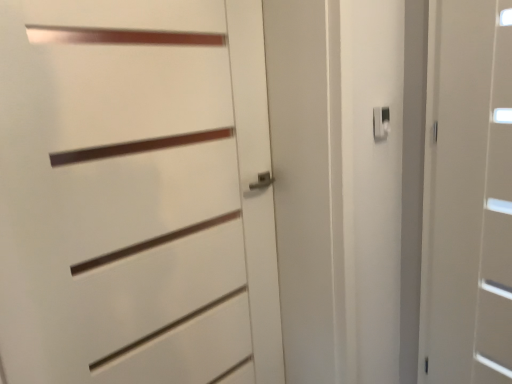
The height and width of the screenshot is (384, 512). What do you see at coordinates (381, 123) in the screenshot?
I see `white plastic latch at upper right` at bounding box center [381, 123].

Locate an element on the screen. The width and height of the screenshot is (512, 384). white matte door at right, placed as the first door when sorted from right to left is located at coordinates (467, 195).

Is white matte door at center, which is counted as the 2th door, starting from the right, not close to white plastic latch at upper right?

white matte door at center, which is counted as the 2th door, starting from the right, is actually quite close to white plastic latch at upper right.

Between white matte door at center, which is counted as the 2th door, starting from the right, and white plastic latch at upper right, which one has less height?

Standing shorter between the two is white plastic latch at upper right.

Does white matte door at center, which is counted as the 2th door, starting from the right, turn towards white plastic latch at upper right?

No.

Is white matte door at right, placed as the first door when sorted from right to left, surrounding white plastic latch at upper right?

No, white plastic latch at upper right is not inside white matte door at right, placed as the first door when sorted from right to left.

Considering the relative sizes of white matte door at right, placed as the first door when sorted from right to left, and white plastic latch at upper right in the image provided, is white matte door at right, placed as the first door when sorted from right to left, thinner than white plastic latch at upper right?

In fact, white matte door at right, placed as the first door when sorted from right to left, might be wider than white plastic latch at upper right.

Is point (450, 106) closer to viewer compared to point (384, 128)?

That is True.

Could you tell me if white matte door at right, which ranks as the 2th door in left-to-right order, is turned towards white plastic latch at upper right?

No, white matte door at right, which ranks as the 2th door in left-to-right order, is not oriented towards white plastic latch at upper right.

Is white plastic latch at upper right in front of or behind white matte door at right, placed as the first door when sorted from right to left, in the image?

white plastic latch at upper right is behind white matte door at right, placed as the first door when sorted from right to left.

Looking at this image, from a real-world perspective, is white plastic latch at upper right positioned under white matte door at right, which ranks as the 2th door in left-to-right order, based on gravity?

No, from a real-world perspective, white plastic latch at upper right is not below white matte door at right, which ranks as the 2th door in left-to-right order.

What's the angular difference between white plastic latch at upper right and white matte door at right, which ranks as the 2th door in left-to-right order,'s facing directions?

The facing directions of white plastic latch at upper right and white matte door at right, which ranks as the 2th door in left-to-right order, are 113 degrees apart.

Can we say white plastic latch at upper right lies outside white matte door at center, which is counted as the 1th door, starting from the left?

Yes, white plastic latch at upper right is located beyond the bounds of white matte door at center, which is counted as the 1th door, starting from the left.

Which object is thinner, white plastic latch at upper right or white matte door at center, which is counted as the 2th door, starting from the right?

white plastic latch at upper right is thinner.

Does white plastic latch at upper right have a smaller size compared to white matte door at center, which is counted as the 1th door, starting from the left?

Yes, white plastic latch at upper right is smaller than white matte door at center, which is counted as the 1th door, starting from the left.

Are white matte door at center, which is counted as the 2th door, starting from the right, and white matte door at right, which ranks as the 2th door in left-to-right order, beside each other?

No.

Locate an element on the screen. This screenshot has width=512, height=384. door below the white matte door at center, which is counted as the 2th door, starting from the right (from a real-world perspective) is located at coordinates (467, 195).

In the scene shown: What's the angular difference between white matte door at center, which is counted as the 1th door, starting from the left, and white matte door at right, which ranks as the 2th door in left-to-right order,'s facing directions?

They differ by 113 degrees in their facing directions.

Which is in front, point (471, 374) or point (92, 6)?

Positioned in front is point (92, 6).

Is white matte door at right, placed as the first door when sorted from right to left, far away from white matte door at center, which is counted as the 1th door, starting from the left?

No, white matte door at right, placed as the first door when sorted from right to left, is not far away from white matte door at center, which is counted as the 1th door, starting from the left.

In terms of width, does white matte door at right, placed as the first door when sorted from right to left, look wider or thinner when compared to white matte door at center, which is counted as the 2th door, starting from the right?

Clearly, white matte door at right, placed as the first door when sorted from right to left, has more width compared to white matte door at center, which is counted as the 2th door, starting from the right.

You are a GUI agent. You are given a task and a screenshot of the screen. Output one action in this format:
    pyautogui.click(x=<x>, y=<y>)
    Task: Click on the latch on the right of white matte door at center, which is counted as the 1th door, starting from the left
    This screenshot has height=384, width=512.
    Given the screenshot: What is the action you would take?
    pyautogui.click(x=381, y=123)

The width and height of the screenshot is (512, 384). What are the coordinates of `latch that appears on the left of white matte door at right, which ranks as the 2th door in left-to-right order` in the screenshot? It's located at (381, 123).

Looking at the image, which one is located closer to white matte door at center, which is counted as the 2th door, starting from the right, white matte door at right, which ranks as the 2th door in left-to-right order, or white plastic latch at upper right?

white plastic latch at upper right.

From the image, which object appears to be nearer to white matte door at right, which ranks as the 2th door in left-to-right order, white plastic latch at upper right or white matte door at center, which is counted as the 1th door, starting from the left?

Among the two, white plastic latch at upper right is located nearer to white matte door at right, which ranks as the 2th door in left-to-right order.

Consider the image. Estimate the real-world distances between objects in this image. Which object is further from white matte door at right, placed as the first door when sorted from right to left, white matte door at center, which is counted as the 2th door, starting from the right, or white plastic latch at upper right?

white matte door at center, which is counted as the 2th door, starting from the right, lies further to white matte door at right, placed as the first door when sorted from right to left, than the other object.

Looking at the image, which one is located closer to white plastic latch at upper right, white matte door at center, which is counted as the 2th door, starting from the right, or white matte door at right, placed as the first door when sorted from right to left?

Among the two, white matte door at right, placed as the first door when sorted from right to left, is located nearer to white plastic latch at upper right.

Based on their spatial positions, is white matte door at right, placed as the first door when sorted from right to left, or white matte door at center, which is counted as the 2th door, starting from the right, closer to white plastic latch at upper right?

white matte door at right, placed as the first door when sorted from right to left, is closer to white plastic latch at upper right.

Considering their positions, is white plastic latch at upper right positioned closer to white matte door at center, which is counted as the 1th door, starting from the left, than white matte door at right, placed as the first door when sorted from right to left?

white plastic latch at upper right.

In order to click on latch situated between white matte door at center, which is counted as the 1th door, starting from the left, and white matte door at right, which ranks as the 2th door in left-to-right order, from left to right in this screenshot , I will do `click(381, 123)`.